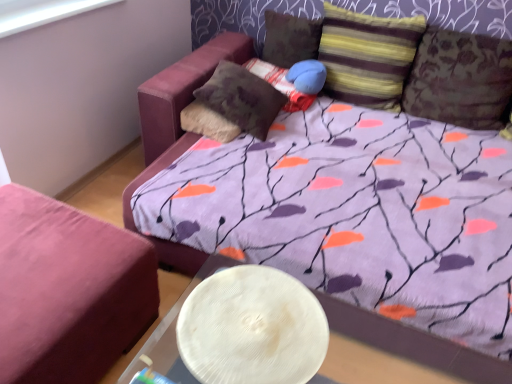
Question: From the image's perspective, relative to white plastic window screen at upper left, is textured brown pillow at upper right, the fifth pillow when ordered from left to right, above or below?

Choices:
 (A) below
 (B) above

Answer: (A)

Question: Is textured brown pillow at upper right, placed as the first pillow when sorted from right to left, bigger or smaller than white plastic window screen at upper left?

Choices:
 (A) small
 (B) big

Answer: (B)

Question: Which is nearer to the white textured plate at lower center?

Choices:
 (A) textured brown pillow at center, positioned as the 5th pillow in right-to-left order
 (B) striped fabric pillow at upper right, the second pillow viewed from the right
 (C) velvet pink ottoman at lower left
 (D) white plastic window screen at upper left
 (E) velvet-like brown pillow at center, the 4th pillow when ordered from right to left

Answer: (C)

Question: Which is farther from the white plastic window screen at upper left?

Choices:
 (A) textured brown pillow at center, positioned as the 5th pillow in right-to-left order
 (B) textured brown pillow at upper right, the fifth pillow when ordered from left to right
 (C) white textured plate at lower center
 (D) velvet-like brown pillow at center, the 4th pillow when ordered from right to left
 (E) striped fabric pillow at upper right, the second pillow viewed from the right

Answer: (B)